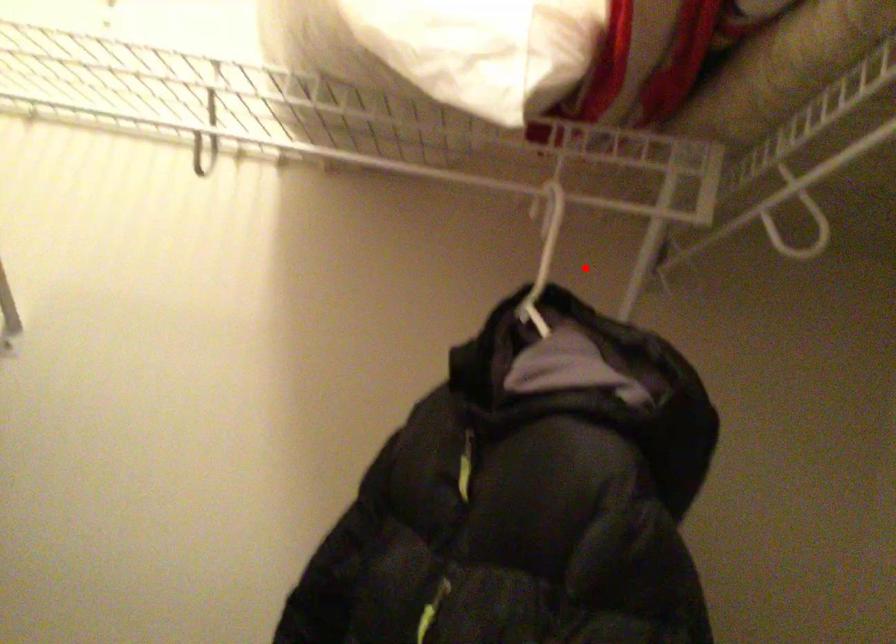
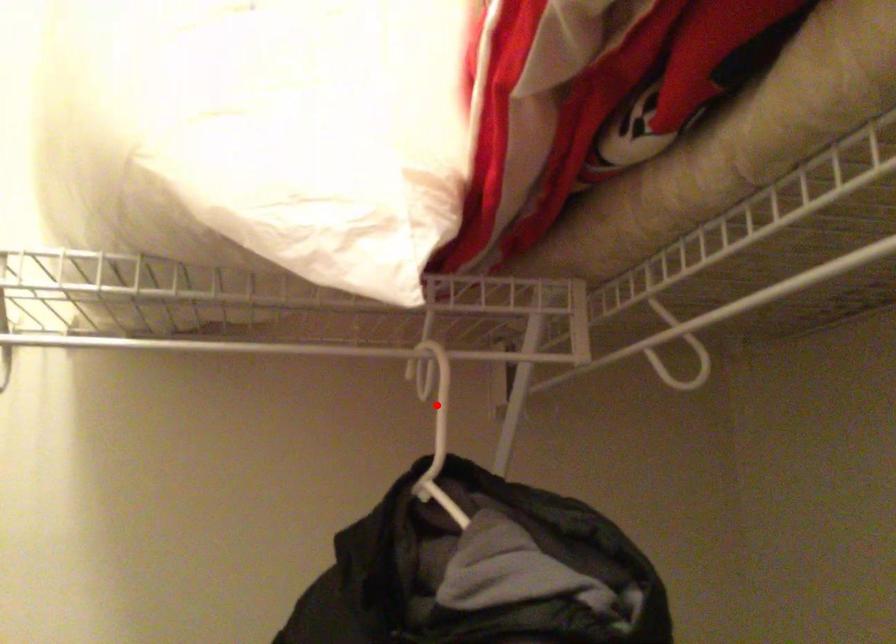
I am providing you with two images of the same scene from different viewpoints. A red point is marked on the first image and another point is marked on the second image. Do the highlighted points in image1 and image2 indicate the same real-world spot?

Yes